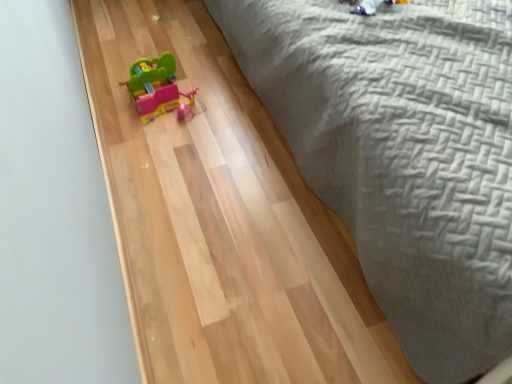
This screenshot has width=512, height=384. Find the location of `spots to the right of matte plastic toy car at center`. spots to the right of matte plastic toy car at center is located at coordinates (227, 99).